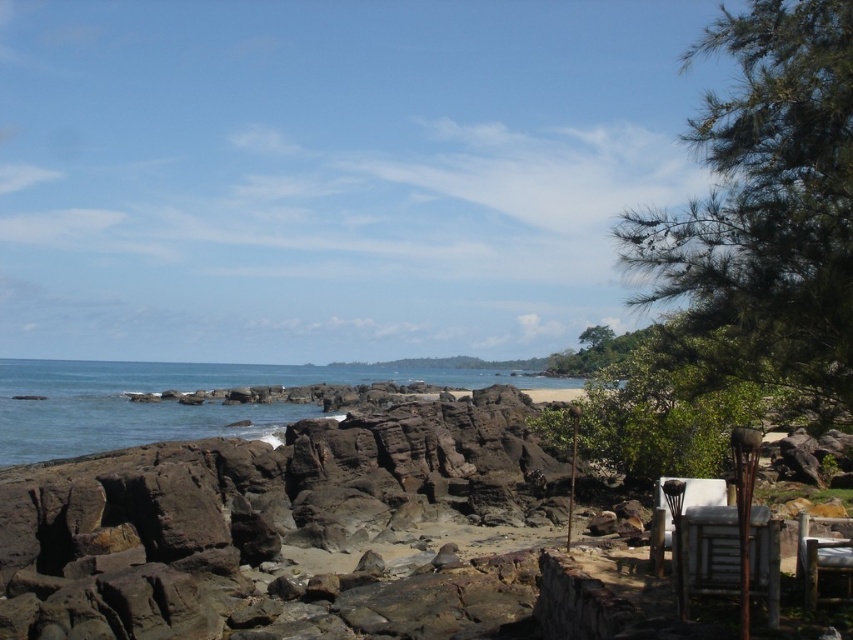
You are standing on the brown rock beach at center and want to walk to the blue water at center. Which direction should you go?

Since the brown rock beach at center is above the blue water at center, you should walk downward towards the blue water at center.

You are standing on the brown rock beach at center and want to reach the wooden chair at lower right. According to the scene, which direction should you move to get there?

The brown rock beach at center is below the wooden chair at lower right, so you should move upward to reach it.

You are standing at the shoreline in the coastal landscape and want to walk to the distant silhouette in the background. Which of the two points, point (234, 381) or point (811, 540), is closer to your current position?

Point (234, 381) is closer to your current position because it is further to the viewer than point (811, 540), which is farther away.